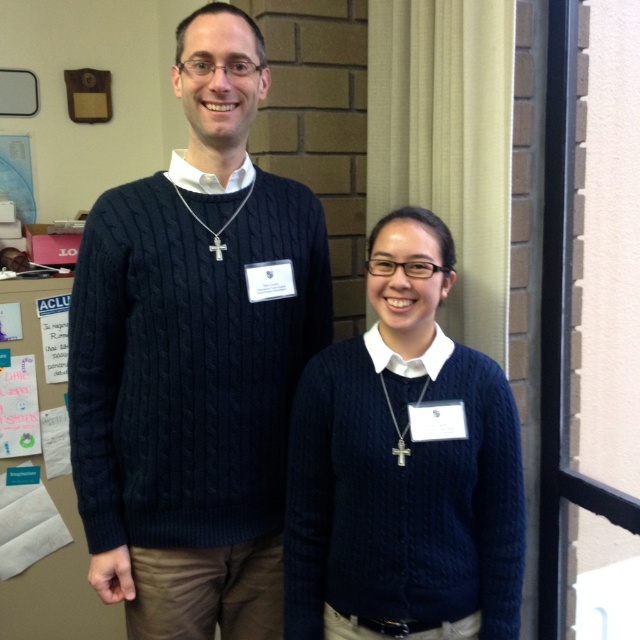
You are an observer standing in front of the image. There is a point at coordinates (195, 358). What object is located at that point?

The cable knit sweater at center is represented by point (195, 358).